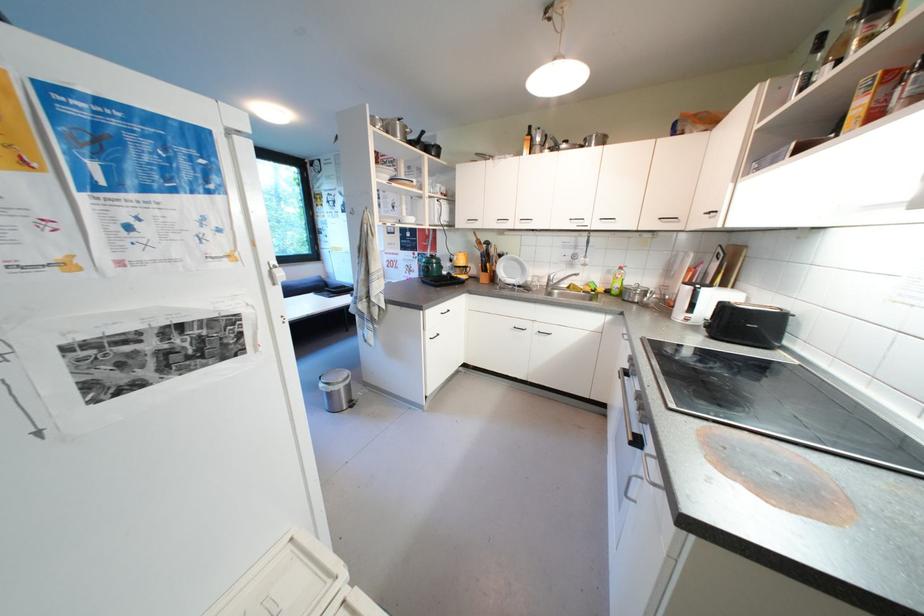
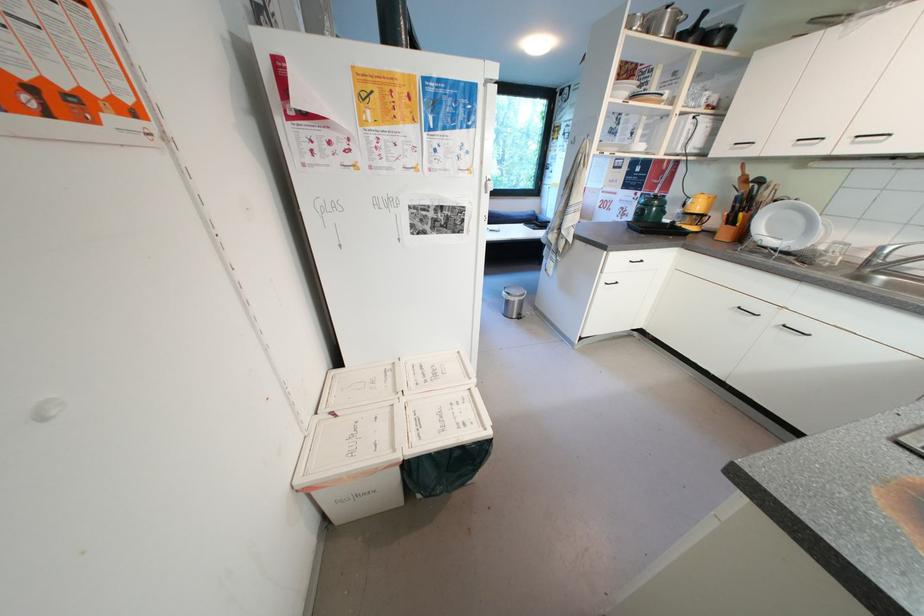
Where in the second image is the point corresponding to pixel 330 387 from the first image?

(512, 294)